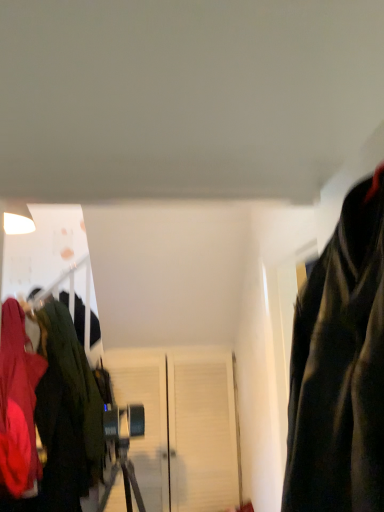
The height and width of the screenshot is (512, 384). Describe the element at coordinates (182, 426) in the screenshot. I see `white matte door at center` at that location.

At what (x,y) coordinates should I click in order to perform the action: click on matte red jacket at left, which is counted as the first jacket, starting from the front. Please return your answer as a coordinate pair (x, y). This screenshot has height=512, width=384. Looking at the image, I should click on (18, 404).

Based on the photo, does matte red jacket at left, which is counted as the first jacket, starting from the front, have a greater width compared to white matte door at center?

Yes, matte red jacket at left, which is counted as the first jacket, starting from the front, is wider than white matte door at center.

This screenshot has width=384, height=512. I want to click on door that appears below the matte red jacket at left, which is the 2th jacket in back-to-front order (from the image's perspective), so click(182, 426).

Is velvet green jacket at left, which is counted as the first jacket, starting from the back, spatially inside white matte door at center, or outside of it?

velvet green jacket at left, which is counted as the first jacket, starting from the back, is spatially situated outside white matte door at center.

From their relative heights in the image, would you say velvet green jacket at left, which is counted as the first jacket, starting from the back, is taller or shorter than white matte door at center?

In the image, velvet green jacket at left, which is counted as the first jacket, starting from the back, appears to be taller than white matte door at center.

From the image's perspective, which is below, velvet green jacket at left, which is counted as the first jacket, starting from the back, or white matte door at center?

white matte door at center appears lower in the image.

Considering the sizes of velvet green jacket at left, the second jacket when ordered from front to back, and white matte door at center in the image, is velvet green jacket at left, the second jacket when ordered from front to back, bigger or smaller than white matte door at center?

velvet green jacket at left, the second jacket when ordered from front to back, is bigger than white matte door at center.

From the image's perspective, which one is positioned higher, velvet green jacket at left, the second jacket when ordered from front to back, or matte red jacket at left, which is counted as the first jacket, starting from the front?

matte red jacket at left, which is counted as the first jacket, starting from the front, from the image's perspective.

How distant is velvet green jacket at left, which is counted as the first jacket, starting from the back, from matte red jacket at left, which is the 2th jacket in back-to-front order?

They are 7.42 inches apart.

Considering the positions of objects velvet green jacket at left, which is counted as the first jacket, starting from the back, and matte red jacket at left, which is the 2th jacket in back-to-front order, in the image provided, who is more to the left, velvet green jacket at left, which is counted as the first jacket, starting from the back, or matte red jacket at left, which is the 2th jacket in back-to-front order,?

matte red jacket at left, which is the 2th jacket in back-to-front order, is more to the left.

Based on the photo, does white matte door at center have a larger size compared to matte red jacket at left, which is counted as the first jacket, starting from the front?

No.

Which is correct: white matte door at center is inside matte red jacket at left, which is counted as the first jacket, starting from the front, or outside of it?

The correct answer is: outside.

Relative to matte red jacket at left, which is the 2th jacket in back-to-front order, is white matte door at center in front or behind?

Clearly, white matte door at center is behind matte red jacket at left, which is the 2th jacket in back-to-front order.

From the image's perspective, would you say matte red jacket at left, which is the 2th jacket in back-to-front order, is positioned over velvet green jacket at left, the second jacket when ordered from front to back?

Correct, matte red jacket at left, which is the 2th jacket in back-to-front order, appears higher than velvet green jacket at left, the second jacket when ordered from front to back, in the image.

At what (x,y) coordinates should I click in order to perform the action: click on jacket behind the matte red jacket at left, which is the 2th jacket in back-to-front order. Please return your answer as a coordinate pair (x, y). Looking at the image, I should click on (67, 413).

From a real-world perspective, relative to velvet green jacket at left, the second jacket when ordered from front to back, is matte red jacket at left, which is counted as the first jacket, starting from the front, vertically above or below?

From a real-world perspective, matte red jacket at left, which is counted as the first jacket, starting from the front, is physically above velvet green jacket at left, the second jacket when ordered from front to back.

Would you say white matte door at center contains velvet green jacket at left, the second jacket when ordered from front to back?

No, velvet green jacket at left, the second jacket when ordered from front to back, is located outside of white matte door at center.

From the image's perspective, is white matte door at center positioned above or below velvet green jacket at left, which is counted as the first jacket, starting from the back?

Based on their image positions, white matte door at center is located beneath velvet green jacket at left, which is counted as the first jacket, starting from the back.

Can you confirm if white matte door at center is positioned to the right of velvet green jacket at left, which is counted as the first jacket, starting from the back?

Indeed, white matte door at center is positioned on the right side of velvet green jacket at left, which is counted as the first jacket, starting from the back.

In terms of size, does white matte door at center appear bigger or smaller than velvet green jacket at left, which is counted as the first jacket, starting from the back?

white matte door at center is smaller than velvet green jacket at left, which is counted as the first jacket, starting from the back.

Find the location of a particular element. the 2nd jacket above the white matte door at center (from a real-world perspective) is located at coordinates (18, 404).

At what (x,y) coordinates should I click in order to perform the action: click on door on the right of velvet green jacket at left, which is counted as the first jacket, starting from the back. Please return your answer as a coordinate pair (x, y). Looking at the image, I should click on (182, 426).

Which object lies nearer to the anchor point matte red jacket at left, which is the 2th jacket in back-to-front order, velvet green jacket at left, which is counted as the first jacket, starting from the back, or white matte door at center?

velvet green jacket at left, which is counted as the first jacket, starting from the back, is closer to matte red jacket at left, which is the 2th jacket in back-to-front order.

Estimate the real-world distances between objects in this image. Which object is closer to velvet green jacket at left, the second jacket when ordered from front to back, white matte door at center or matte red jacket at left, which is counted as the first jacket, starting from the front?

Among the two, matte red jacket at left, which is counted as the first jacket, starting from the front, is located nearer to velvet green jacket at left, the second jacket when ordered from front to back.

Looking at this image, when comparing their distances from white matte door at center, does velvet green jacket at left, the second jacket when ordered from front to back, or matte red jacket at left, which is counted as the first jacket, starting from the front, seem closer?

velvet green jacket at left, the second jacket when ordered from front to back, is closer to white matte door at center.

Estimate the real-world distances between objects in this image. Which object is further from velvet green jacket at left, the second jacket when ordered from front to back, matte red jacket at left, which is the 2th jacket in back-to-front order, or white matte door at center?

Based on the image, white matte door at center appears to be further to velvet green jacket at left, the second jacket when ordered from front to back.

Looking at this image, based on their spatial positions, is matte red jacket at left, which is counted as the first jacket, starting from the front, or velvet green jacket at left, which is counted as the first jacket, starting from the back, further from white matte door at center?

The object further to white matte door at center is matte red jacket at left, which is counted as the first jacket, starting from the front.

Which object lies nearer to the anchor point matte red jacket at left, which is the 2th jacket in back-to-front order, white matte door at center or velvet green jacket at left, the second jacket when ordered from front to back?

velvet green jacket at left, the second jacket when ordered from front to back, lies closer to matte red jacket at left, which is the 2th jacket in back-to-front order, than the other object.

This screenshot has width=384, height=512. I want to click on jacket situated between matte red jacket at left, which is counted as the first jacket, starting from the front, and white matte door at center from left to right, so click(x=67, y=413).